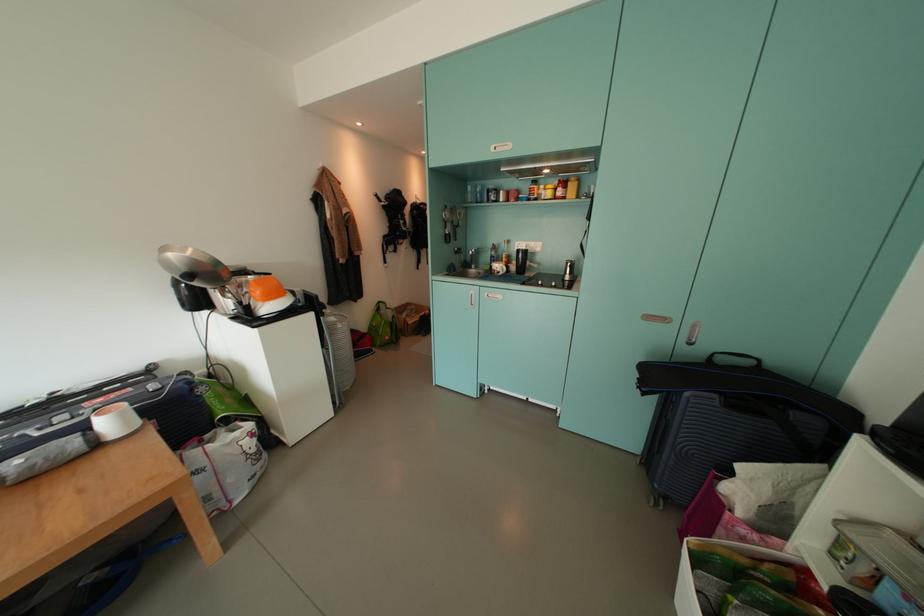
Locate an element on the screen. This screenshot has height=616, width=924. sink faucet handle is located at coordinates (472, 257).